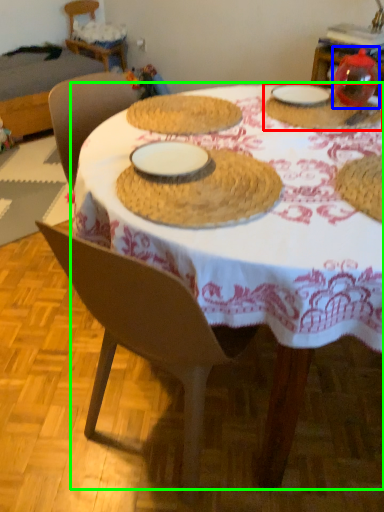
Question: Which object is positioned closest to tableware (highlighted by a red box)? Select from tableware (highlighted by a blue box) and table (highlighted by a green box).

Choices:
 (A) tableware
 (B) table

Answer: (A)